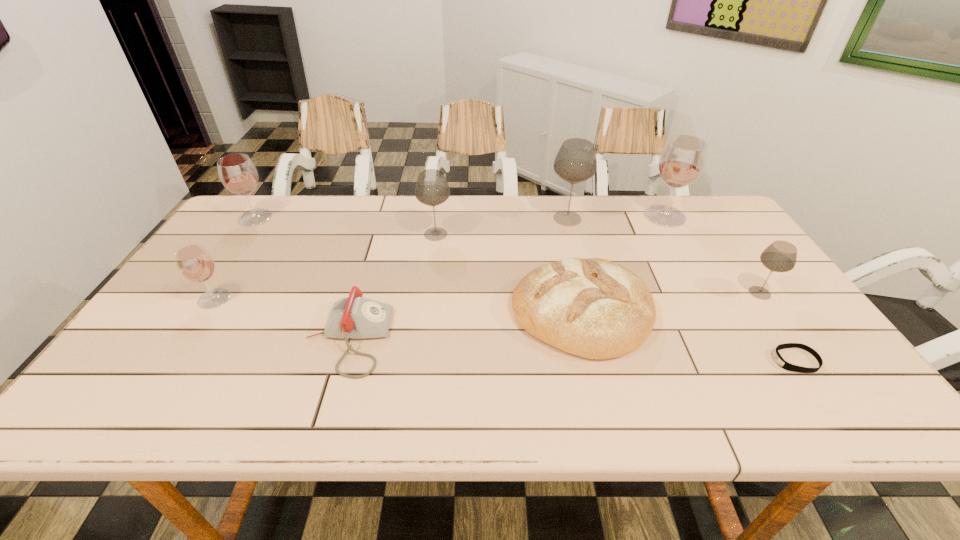
You are a GUI agent. You are given a task and a screenshot of the screen. Output one action in this format:
    pyautogui.click(x=<x>, y=<y>)
    Task: Click on the third shortest object
    The image size is (960, 540).
    Given the screenshot: What is the action you would take?
    pyautogui.click(x=594, y=308)

The height and width of the screenshot is (540, 960). Identify the location of telephone. (354, 317).

You are a GUI agent. You are given a task and a screenshot of the screen. Output one action in this format:
    pyautogui.click(x=<x>, y=<y>)
    Task: Click on the red telephone
    This screenshot has height=540, width=960.
    Given the screenshot: What is the action you would take?
    pyautogui.click(x=354, y=317)

Where is `wristband`? The height and width of the screenshot is (540, 960). wristband is located at coordinates (781, 362).

Locate an element on the screen. This screenshot has height=540, width=960. vacant space situated on the front of the rightmost red wineglass is located at coordinates (706, 287).

Where is `free spot located 0.110m on the left of the second gray wineglass from left to right`? Image resolution: width=960 pixels, height=540 pixels. free spot located 0.110m on the left of the second gray wineglass from left to right is located at coordinates (514, 219).

At what (x,y) coordinates should I click in order to perform the action: click on free location located on the front of the second smallest red wineglass. Please return your answer as a coordinate pair (x, y). This screenshot has height=540, width=960. Looking at the image, I should click on (195, 304).

What are the coordinates of `vacant area located 0.170m on the right of the leftmost gray wineglass` in the screenshot? It's located at (507, 234).

Locate an element on the screen. The width and height of the screenshot is (960, 540). free space located on the back of the nearest red wineglass is located at coordinates (252, 240).

Where is `vacant area situated on the back of the smallest gray wineglass`? This screenshot has width=960, height=540. vacant area situated on the back of the smallest gray wineglass is located at coordinates (728, 248).